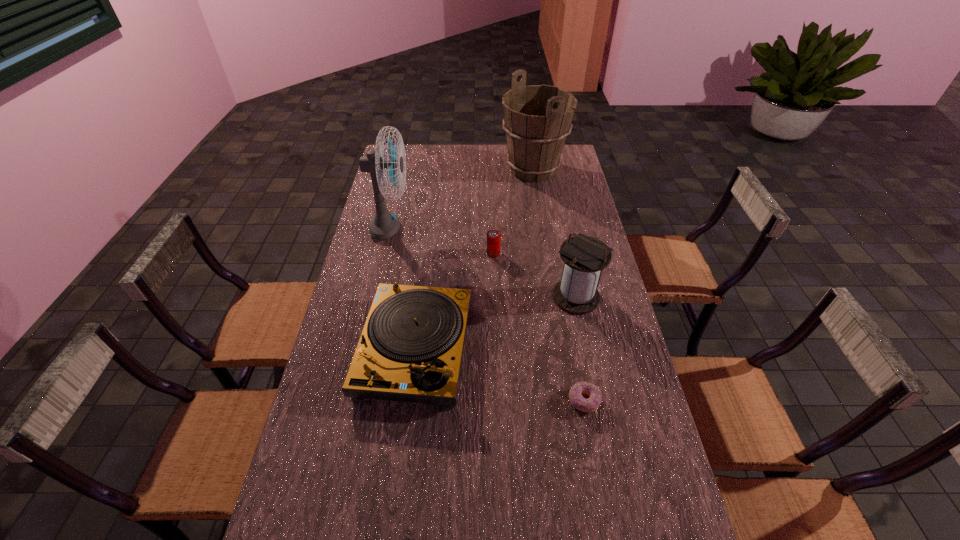
At what (x,y) coordinates should I click in order to perform the action: click on free space at the far edge of the desktop. Please return your answer as a coordinate pair (x, y). This screenshot has height=540, width=960. Looking at the image, I should click on coord(509,168).

In the image, there is a desktop. Identify the location of free region at the left edge. (407, 181).

In the image, there is a desktop. Find the location of `vacant area at the right edge`. vacant area at the right edge is located at coordinates (628, 437).

In order to click on free space at the far right corner of the desktop in this screenshot , I will do [x=571, y=159].

The image size is (960, 540). I want to click on free space between the fan and the farthest object, so click(x=462, y=200).

I want to click on empty space between the farthest object and the can, so click(514, 212).

Locate an element on the screen. This screenshot has width=960, height=540. vacant area between the lantern and the doughnut is located at coordinates (580, 349).

Where is `free space between the lantern and the second shortest object`? The width and height of the screenshot is (960, 540). free space between the lantern and the second shortest object is located at coordinates (535, 275).

Where is `empty space between the bucket and the third shortest object`? empty space between the bucket and the third shortest object is located at coordinates 474,260.

This screenshot has height=540, width=960. Identify the location of empty location between the lantern and the doughnut. (580, 349).